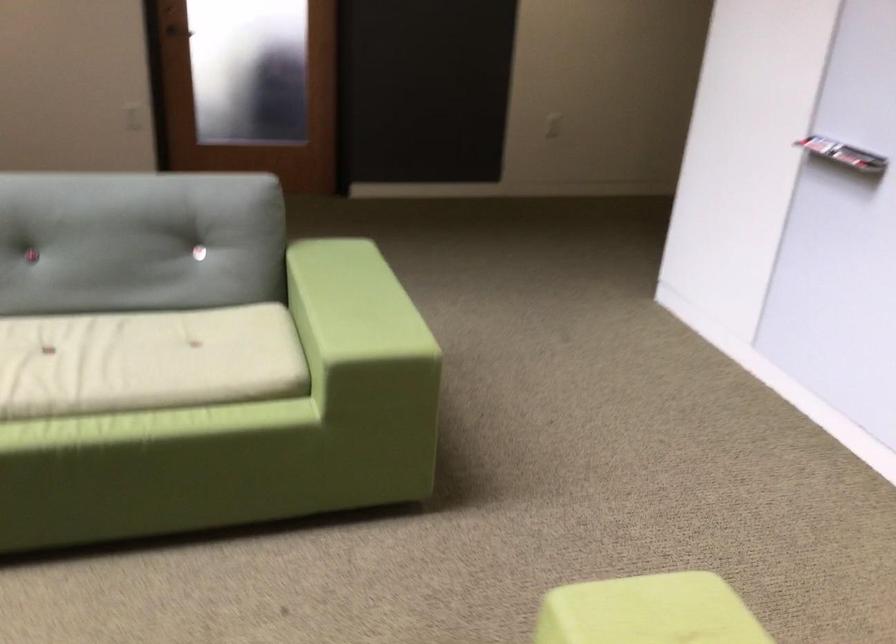
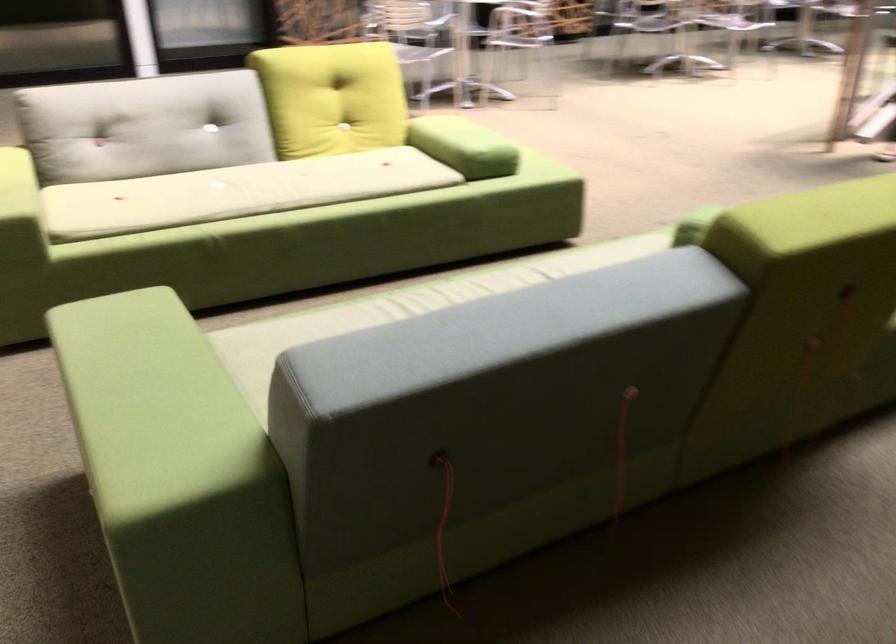
Find the pixel in the second image that matches point 82,371 in the first image.

(401, 308)